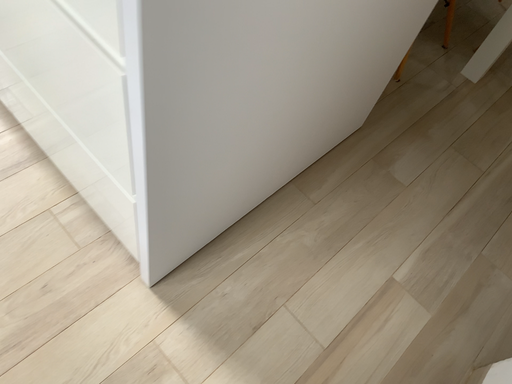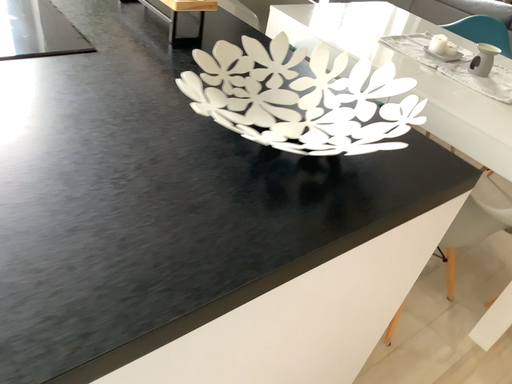
Question: How did the camera likely rotate when shooting the video?

Choices:
 (A) rotated downward
 (B) rotated upward

Answer: (B)